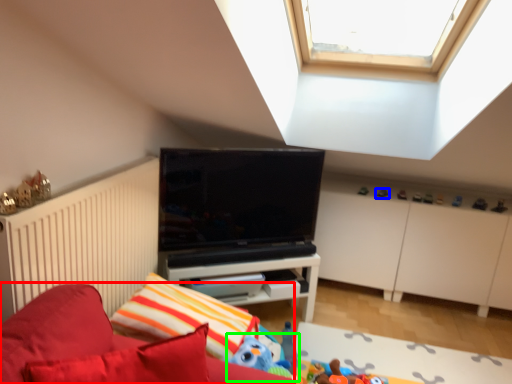
Question: Estimate the real-world distances between objects in this image. Which object is farther from furniture (highlighted by a red box), toy (highlighted by a blue box) or toy (highlighted by a green box)?

Choices:
 (A) toy
 (B) toy

Answer: (A)